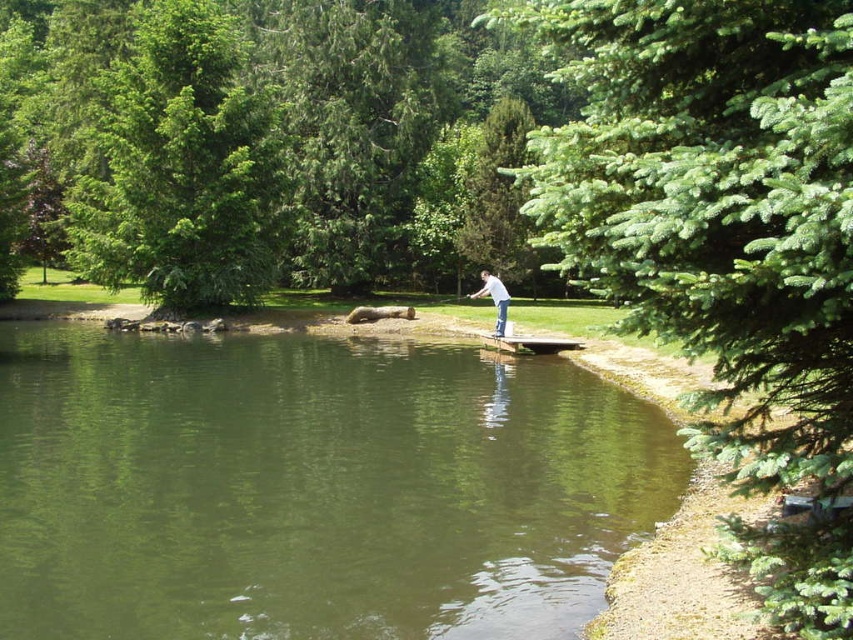
Question: Does green water at center appear over white matte shirt at center?

Choices:
 (A) no
 (B) yes

Answer: (A)

Question: Among these points, which one is farthest from the camera?

Choices:
 (A) (819, 308)
 (B) (207, 19)
 (C) (456, 625)
 (D) (485, 285)

Answer: (B)

Question: Is green water at center below green needle-like tree at right?

Choices:
 (A) yes
 (B) no

Answer: (A)

Question: Does green needle-like tree at right appear on the left side of green leafy tree at left?

Choices:
 (A) no
 (B) yes

Answer: (A)

Question: Based on their relative distances, which object is nearer to the green needle-like tree at right?

Choices:
 (A) white matte shirt at center
 (B) green leafy tree at left

Answer: (A)

Question: Considering the real-world distances, which object is farthest from the green needle-like tree at right?

Choices:
 (A) white matte shirt at center
 (B) green leafy tree at left
 (C) green water at center

Answer: (B)